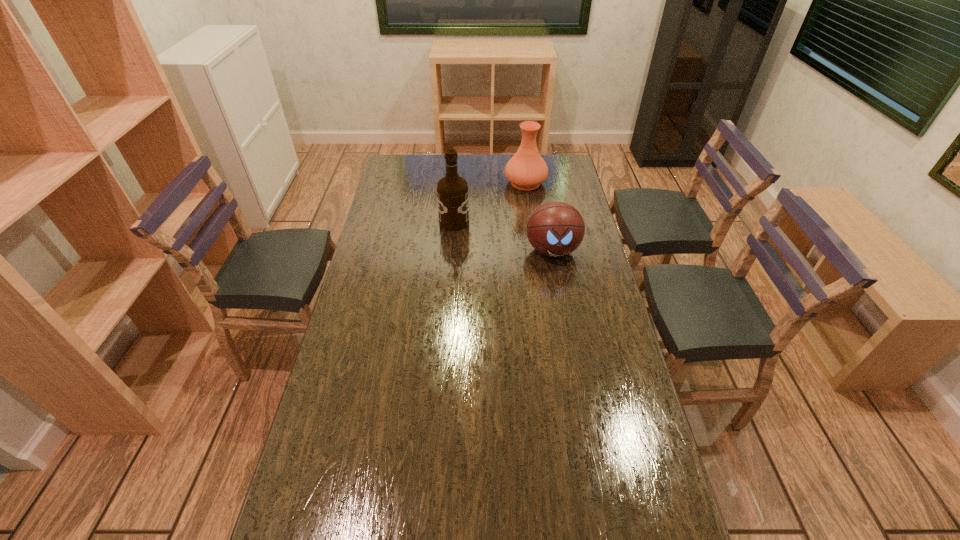
The height and width of the screenshot is (540, 960). Find the location of `vase present at the right edge`. vase present at the right edge is located at coordinates (526, 170).

I want to click on basketball that is at the right edge, so click(x=555, y=229).

At what (x,y) coordinates should I click in order to perform the action: click on object that is at the far right corner. Please return your answer as a coordinate pair (x, y). Looking at the image, I should click on (526, 170).

Identify the location of free region at the far edge of the desktop. Image resolution: width=960 pixels, height=540 pixels. (472, 171).

Image resolution: width=960 pixels, height=540 pixels. Find the location of `vacant area at the left edge`. vacant area at the left edge is located at coordinates (363, 267).

This screenshot has height=540, width=960. I want to click on vacant space at the right edge, so click(549, 192).

Locate an element on the screen. The image size is (960, 540). empty space that is in between the leftmost object and the vase is located at coordinates (490, 202).

Find the location of a particular element. The image size is (960, 540). object that is the second closest one to the farthest object is located at coordinates (555, 229).

Locate an element on the screen. Image resolution: width=960 pixels, height=540 pixels. object identified as the second closest to the vase is located at coordinates (555, 229).

Identify the location of vacant region that satisfies the following two spatial constraints: 1. on the label of the leftmost object; 2. on the back side of the shortest object. (452, 251).